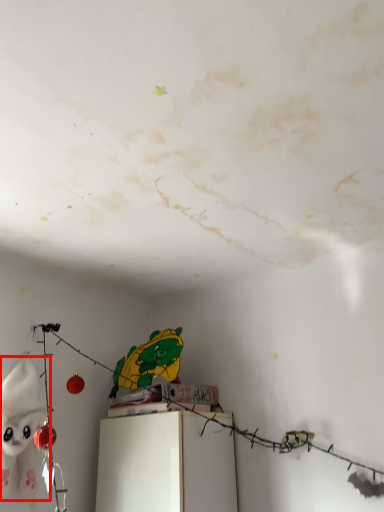
Question: In this image, where is toy (annotated by the red box) located relative to furniture?

Choices:
 (A) right
 (B) left

Answer: (B)